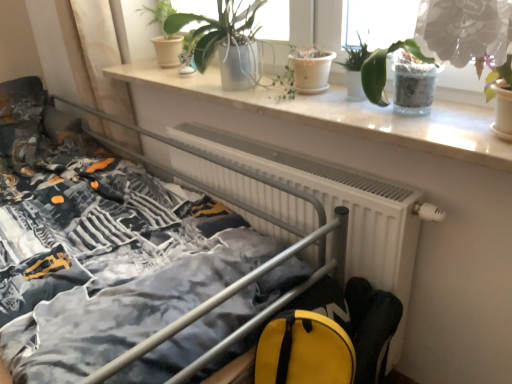
The height and width of the screenshot is (384, 512). What do you see at coordinates (165, 35) in the screenshot? I see `green matte plant at upper center, acting as the first houseplant starting from the left` at bounding box center [165, 35].

The width and height of the screenshot is (512, 384). I want to click on metallic gray bed at center, so click(98, 230).

Can you confirm if translucent glass pot at upper right, arranged as the second houseplant when viewed from the right, is thinner than green matte plant at upper center, acting as the first houseplant starting from the left?

Indeed, translucent glass pot at upper right, arranged as the second houseplant when viewed from the right, has a lesser width compared to green matte plant at upper center, acting as the first houseplant starting from the left.

From a real-world perspective, which object stands above the other?

green matte plant at upper center, acting as the first houseplant starting from the left.

Is translucent glass pot at upper right, arranged as the fourth houseplant when viewed from the left, oriented towards green matte plant at upper center, acting as the first houseplant starting from the left?

No, translucent glass pot at upper right, arranged as the fourth houseplant when viewed from the left, is not oriented towards green matte plant at upper center, acting as the first houseplant starting from the left.

What's the angular difference between metallic gray bed at center and white matte radiator at center's facing directions?

They differ by 0.000706 degrees in their facing directions.

Is metallic gray bed at center situated inside white matte radiator at center or outside?

metallic gray bed at center is located beyond the bounds of white matte radiator at center.

Between metallic gray bed at center and white matte radiator at center, which one has larger width?

metallic gray bed at center.

Does metallic gray bed at center have a lesser height compared to white matte radiator at center?

Incorrect, the height of metallic gray bed at center does not fall short of that of white matte radiator at center.

Is white marble window sill at upper center wider than metallic gray bed at center?

No.

From the picture: Is metallic gray bed at center surrounded by white marble window sill at upper center?

Definitely not — metallic gray bed at center is not inside white marble window sill at upper center.

Does white marble window sill at upper center come behind metallic gray bed at center?

Yes.

Does matte white pot at upper center, acting as the fourth houseplant starting from the right, have a greater width compared to green leafy plant at upper center, which is the third houseplant in right-to-left order?

Yes, matte white pot at upper center, acting as the fourth houseplant starting from the right, is wider than green leafy plant at upper center, which is the third houseplant in right-to-left order.

Is matte white pot at upper center, acting as the fourth houseplant starting from the right, spatially inside green leafy plant at upper center, the 3th houseplant positioned from the left, or outside of it?

matte white pot at upper center, acting as the fourth houseplant starting from the right, is not inside green leafy plant at upper center, the 3th houseplant positioned from the left, it's outside.

Which object is more forward, matte white pot at upper center, marked as the 2th houseplant in a left-to-right arrangement, or green leafy plant at upper center, the 3th houseplant positioned from the left?

green leafy plant at upper center, the 3th houseplant positioned from the left, is in front.

Is matte white pot at upper center, acting as the fourth houseplant starting from the right, beside green leafy plant at upper center, which is the third houseplant in right-to-left order?

No, matte white pot at upper center, acting as the fourth houseplant starting from the right, is not next to green leafy plant at upper center, which is the third houseplant in right-to-left order.

Are green matte plant at upper center, which ranks as the 5th houseplant in right-to-left order, and white marble window sill at upper center far apart?

That's not correct — green matte plant at upper center, which ranks as the 5th houseplant in right-to-left order, is a little close to white marble window sill at upper center.

Is point (163, 47) positioned in front of point (317, 103)?

That is False.

From the image's perspective, who appears lower, green matte plant at upper center, which ranks as the 5th houseplant in right-to-left order, or white marble window sill at upper center?

white marble window sill at upper center is shown below in the image.

Is green matte plant at upper center, acting as the first houseplant starting from the left, looking in the opposite direction of white marble window sill at upper center?

No, green matte plant at upper center, acting as the first houseplant starting from the left, is not facing the opposite direction of white marble window sill at upper center.

Looking at this image, is matte white pot at upper center, acting as the fourth houseplant starting from the right, at the back of green leafy plant at upper center, which is the third houseplant in right-to-left order?

No, green leafy plant at upper center, which is the third houseplant in right-to-left order,'s orientation is not away from matte white pot at upper center, acting as the fourth houseplant starting from the right.

Which is more to the left, green leafy plant at upper center, the 3th houseplant positioned from the left, or matte white pot at upper center, acting as the fourth houseplant starting from the right?

matte white pot at upper center, acting as the fourth houseplant starting from the right, is more to the left.

Is green leafy plant at upper center, the 3th houseplant positioned from the left, directly adjacent to matte white pot at upper center, marked as the 2th houseplant in a left-to-right arrangement?

There is a gap between green leafy plant at upper center, the 3th houseplant positioned from the left, and matte white pot at upper center, marked as the 2th houseplant in a left-to-right arrangement.

Which of these two, translucent glass pot at upper right, arranged as the second houseplant when viewed from the right, or green glossy plant at upper right, which appears as the first houseplant when viewed from the right, is thinner?

translucent glass pot at upper right, arranged as the second houseplant when viewed from the right, is thinner.

From the image's perspective, is translucent glass pot at upper right, arranged as the second houseplant when viewed from the right, positioned above or below green glossy plant at upper right, which appears as the first houseplant when viewed from the right?

Based on their image positions, translucent glass pot at upper right, arranged as the second houseplant when viewed from the right, is located above green glossy plant at upper right, which appears as the first houseplant when viewed from the right.

How different are the orientations of translucent glass pot at upper right, arranged as the second houseplant when viewed from the right, and green glossy plant at upper right, which appears as the first houseplant when viewed from the right, in degrees?

0.00032 degrees separate the facing orientations of translucent glass pot at upper right, arranged as the second houseplant when viewed from the right, and green glossy plant at upper right, which appears as the first houseplant when viewed from the right.

Is translucent glass pot at upper right, arranged as the second houseplant when viewed from the right, positioned beyond the bounds of green glossy plant at upper right, which appears as the first houseplant when viewed from the right?

Yes, translucent glass pot at upper right, arranged as the second houseplant when viewed from the right, is outside of green glossy plant at upper right, which appears as the first houseplant when viewed from the right.

Locate an element on the screen. Image resolution: width=512 pixels, height=384 pixels. the 3rd houseplant counting from the right side of the green matte plant at upper center, acting as the first houseplant starting from the left is located at coordinates (384, 70).

This screenshot has width=512, height=384. Find the location of `radiator positioned vertically above the metallic gray bed at center (from a real-world perspective)`. radiator positioned vertically above the metallic gray bed at center (from a real-world perspective) is located at coordinates (337, 202).

From the image, which object appears to be nearer to green matte plant at upper center, which ranks as the 5th houseplant in right-to-left order, green leafy plant at upper center, which is the third houseplant in right-to-left order, or translucent glass pot at upper right, arranged as the second houseplant when viewed from the right?

Among the two, green leafy plant at upper center, which is the third houseplant in right-to-left order, is located nearer to green matte plant at upper center, which ranks as the 5th houseplant in right-to-left order.

Estimate the real-world distances between objects in this image. Which object is further from green matte plant at upper center, which ranks as the 5th houseplant in right-to-left order, white matte radiator at center or matte white pot at upper center, acting as the fourth houseplant starting from the right?

white matte radiator at center lies further to green matte plant at upper center, which ranks as the 5th houseplant in right-to-left order, than the other object.

Based on their spatial positions, is matte white pot at upper center, acting as the fourth houseplant starting from the right, or green matte plant at upper center, which ranks as the 5th houseplant in right-to-left order, further from metallic gray bed at center?

Among the two, green matte plant at upper center, which ranks as the 5th houseplant in right-to-left order, is located further to metallic gray bed at center.

Looking at the image, which one is located further to matte white pot at upper center, acting as the fourth houseplant starting from the right, green matte plant at upper center, which ranks as the 5th houseplant in right-to-left order, or translucent glass pot at upper right, arranged as the second houseplant when viewed from the right?

translucent glass pot at upper right, arranged as the second houseplant when viewed from the right, is further to matte white pot at upper center, acting as the fourth houseplant starting from the right.

Considering their positions, is matte white pot at upper center, marked as the 2th houseplant in a left-to-right arrangement, positioned further to metallic gray bed at center than green leafy plant at upper center, which is the third houseplant in right-to-left order?

The object further to metallic gray bed at center is green leafy plant at upper center, which is the third houseplant in right-to-left order.

From the image, which object appears to be nearer to white matte radiator at center, translucent glass pot at upper right, arranged as the fourth houseplant when viewed from the left, or white marble window sill at upper center?

Based on the image, white marble window sill at upper center appears to be nearer to white matte radiator at center.

From the image, which object appears to be nearer to metallic gray bed at center, white matte radiator at center or green leafy plant at upper center, the 3th houseplant positioned from the left?

white matte radiator at center is positioned closer to the anchor metallic gray bed at center.

Considering their positions, is green leafy plant at upper center, the 3th houseplant positioned from the left, positioned further to green glossy plant at upper right, which appears as the first houseplant when viewed from the right, than metallic gray bed at center?

Among the two, metallic gray bed at center is located further to green glossy plant at upper right, which appears as the first houseplant when viewed from the right.

You are a GUI agent. You are given a task and a screenshot of the screen. Output one action in this format:
    pyautogui.click(x=<x>, y=<y>)
    Task: Click on the window sill between matte white pot at upper center, acting as the fourth houseplant starting from the right, and white matte radiator at center, in the vertical direction
    
    Given the screenshot: What is the action you would take?
    pyautogui.click(x=345, y=114)

Find the location of a particular element. This screenshot has width=512, height=384. radiator located between metallic gray bed at center and green matte plant at upper center, which ranks as the 5th houseplant in right-to-left order, in the depth direction is located at coordinates (337, 202).

Image resolution: width=512 pixels, height=384 pixels. What are the coordinates of `houseplant between green matte plant at upper center, acting as the first houseplant starting from the left, and green leafy plant at upper center, which is the third houseplant in right-to-left order, in the horizontal direction` in the screenshot? It's located at (226, 42).

You are a GUI agent. You are given a task and a screenshot of the screen. Output one action in this format:
    pyautogui.click(x=<x>, y=<y>)
    Task: Click on the window sill located between metallic gray bed at center and green leafy plant at upper center, which is the third houseplant in right-to-left order, in the left-right direction
    
    Given the screenshot: What is the action you would take?
    pyautogui.click(x=345, y=114)